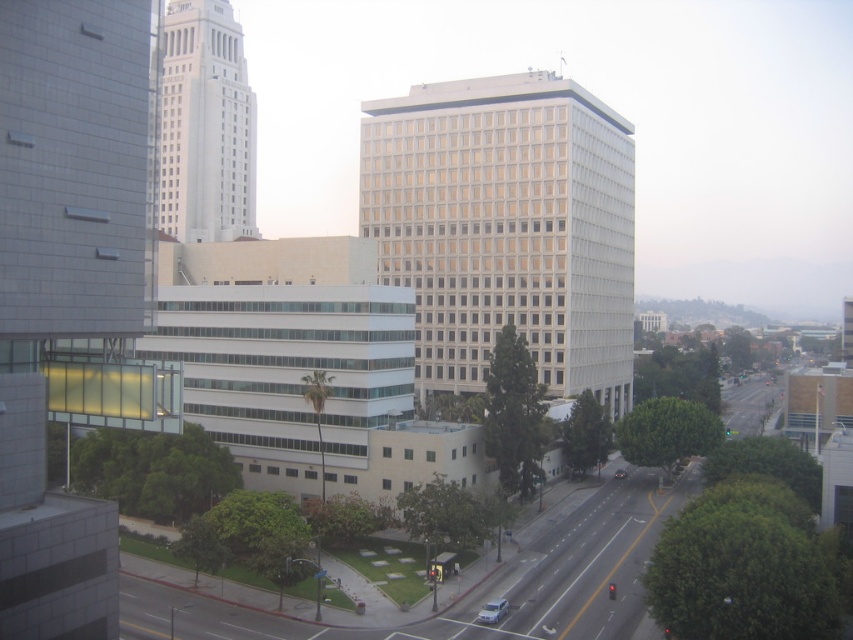
Is white matte car at lower center wider than shiny black sedan at center?

No.

Which is behind, point (486, 609) or point (616, 474)?

The point (616, 474) is more distant.

I want to click on white matte car at lower center, so point(492,611).